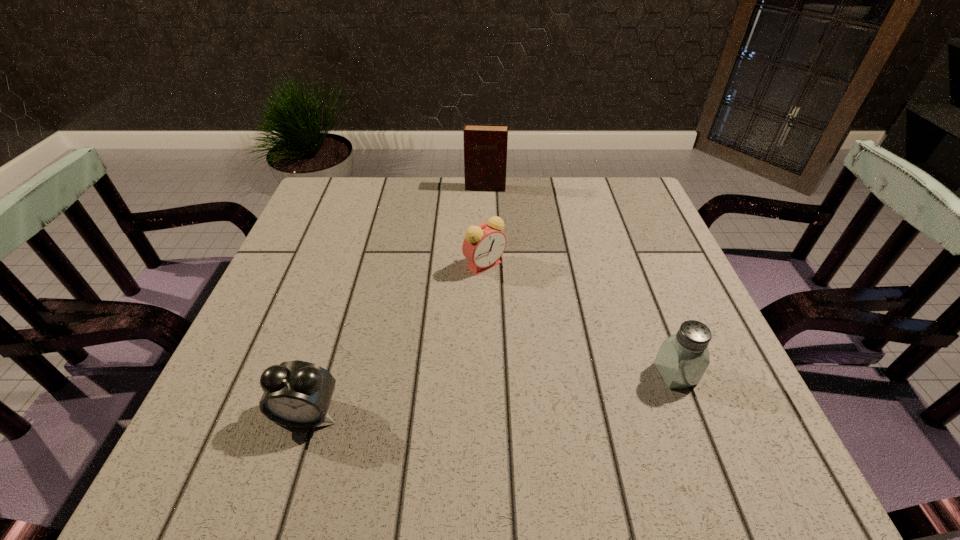
Where is `unoccupied position between the farther alarm clock and the left alarm clock`? This screenshot has width=960, height=540. unoccupied position between the farther alarm clock and the left alarm clock is located at coordinates (396, 339).

Locate an element on the screen. The height and width of the screenshot is (540, 960). empty space between the nearer alarm clock and the farthest object is located at coordinates (396, 301).

The width and height of the screenshot is (960, 540). I want to click on empty space that is in between the farthest object and the third farthest object, so click(580, 281).

Identify the location of free spot between the tallest object and the leftmost object. (396, 301).

At what (x,y) coordinates should I click in order to perform the action: click on vacant area that lies between the leftmost object and the farther alarm clock. Please return your answer as a coordinate pair (x, y). Looking at the image, I should click on (396, 339).

Locate an element on the screen. The height and width of the screenshot is (540, 960). free space that is in between the left alarm clock and the rightmost object is located at coordinates (491, 394).

Where is `free space between the farthest object and the third farthest object`? This screenshot has height=540, width=960. free space between the farthest object and the third farthest object is located at coordinates (580, 281).

Identify which object is the second nearest to the nearest object. Please provide its 2D coordinates. Your answer should be formatted as a tuple, i.e. [(x, y)], where the tuple contains the x and y coordinates of a point satisfying the conditions above.

[(683, 358)]

Locate an element on the screen. object identified as the closest to the right alarm clock is located at coordinates (485, 145).

This screenshot has height=540, width=960. What are the coordinates of `vacant area that satisfies the following two spatial constraints: 1. on the front side of the farther alarm clock; 2. on the left side of the rightmost object` in the screenshot? It's located at (486, 374).